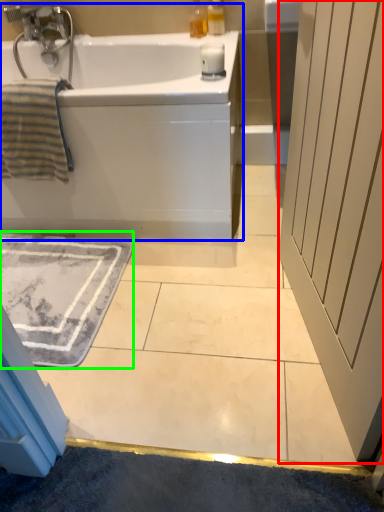
Question: Which is nearer to the screen door (highlighted by a red box)? bathtub (highlighted by a blue box) or bath mat (highlighted by a green box).

Choices:
 (A) bathtub
 (B) bath mat

Answer: (A)